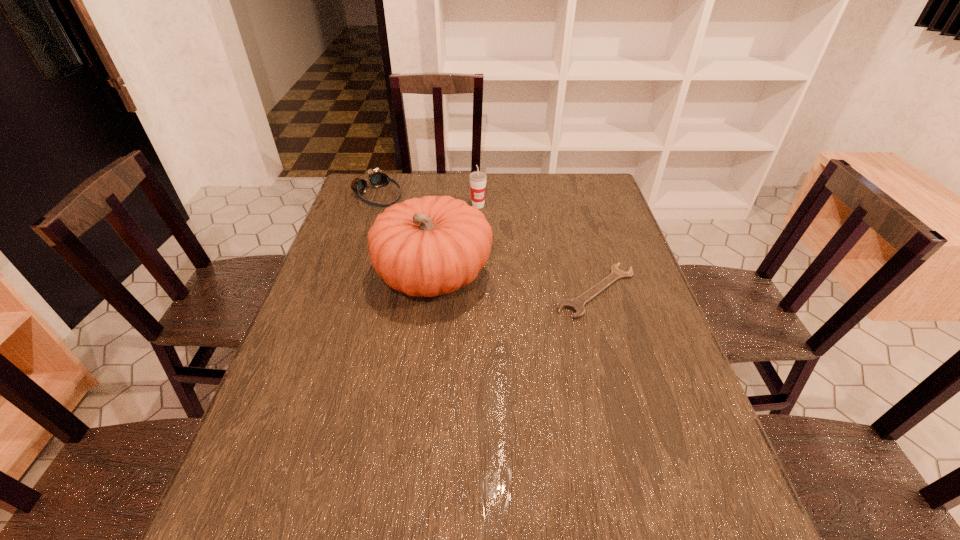
Find the location of a particular element. This screenshot has width=960, height=540. vacant space on the desktop that is between the pumpkin and the shortest object and is positioned on the side of the third shortest object with the logo is located at coordinates (534, 285).

Locate an element on the screen. The width and height of the screenshot is (960, 540). free space on the desktop that is between the pumpkin and the wrench and is positioned through the lenses of the second shortest object is located at coordinates (512, 283).